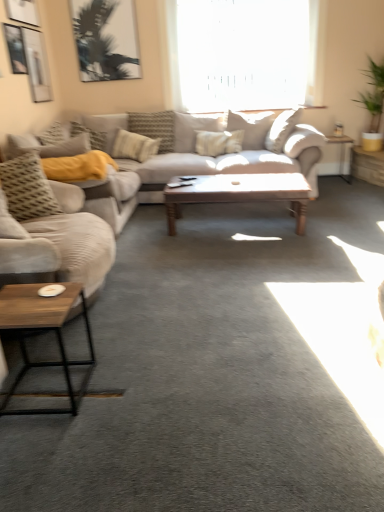
Question: Does beige fabric couch at left, the 1th studio couch positioned from the front, turn towards wooden polished coffee table at center, which is the second coffee table from left to right?

Choices:
 (A) yes
 (B) no

Answer: (A)

Question: Considering the relative positions of beige fabric couch at left, the 1th studio couch positioned from the front, and wooden polished coffee table at center, which is the second coffee table in bottom-to-top order, in the image provided, is beige fabric couch at left, the 1th studio couch positioned from the front, to the right of wooden polished coffee table at center, which is the second coffee table in bottom-to-top order, from the viewer's perspective?

Choices:
 (A) no
 (B) yes

Answer: (A)

Question: Can you see beige fabric couch at left, which ranks as the second studio couch in back-to-front order, touching wooden polished coffee table at center, the 1th coffee table from the right?

Choices:
 (A) yes
 (B) no

Answer: (B)

Question: Can you confirm if beige fabric couch at left, which ranks as the second studio couch in back-to-front order, is smaller than wooden polished coffee table at center, which is the second coffee table from left to right?

Choices:
 (A) no
 (B) yes

Answer: (A)

Question: Is beige fabric couch at left, the 1th studio couch positioned from the front, thinner than wooden polished coffee table at center, which is the second coffee table from left to right?

Choices:
 (A) no
 (B) yes

Answer: (A)

Question: Considering the relative sizes of beige fabric couch at left, the 1th studio couch positioned from the front, and wooden polished coffee table at center, which is the 1th coffee table in top-to-bottom order, in the image provided, is beige fabric couch at left, the 1th studio couch positioned from the front, wider than wooden polished coffee table at center, which is the 1th coffee table in top-to-bottom order,?

Choices:
 (A) yes
 (B) no

Answer: (A)

Question: Is textured beige pillow at center, which is the 1th pillow in right-to-left order, behind transparent glass window at upper center?

Choices:
 (A) yes
 (B) no

Answer: (B)

Question: Is textured beige pillow at center, arranged as the fifth pillow when viewed from the left, to the left of transparent glass window at upper center from the viewer's perspective?

Choices:
 (A) no
 (B) yes

Answer: (A)

Question: Is textured beige pillow at center, positioned as the 2th pillow in back-to-front order, not close to transparent glass window at upper center?

Choices:
 (A) yes
 (B) no

Answer: (B)

Question: Does textured beige pillow at center, which is the 1th pillow in right-to-left order, have a smaller size compared to transparent glass window at upper center?

Choices:
 (A) yes
 (B) no

Answer: (A)

Question: Can you confirm if textured beige pillow at center, positioned as the 2th pillow in back-to-front order, is shorter than transparent glass window at upper center?

Choices:
 (A) no
 (B) yes

Answer: (B)

Question: Is textured beige pillow at center, which is the 1th pillow in right-to-left order, thinner than transparent glass window at upper center?

Choices:
 (A) no
 (B) yes

Answer: (A)

Question: Can you confirm if transparent glass window at upper center is thinner than metallic silver side table at right, marked as the 2th table in a right-to-left arrangement?

Choices:
 (A) no
 (B) yes

Answer: (B)